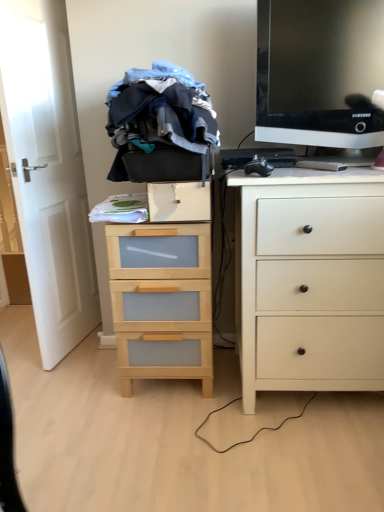
In order to click on vacant area that lies between wooden chest of drawers at center, marked as the second chest of drawers in a right-to-left arrangement, and white matte chest of drawers at right, which is counted as the 2th chest of drawers, starting from the left in this screenshot , I will do `click(221, 392)`.